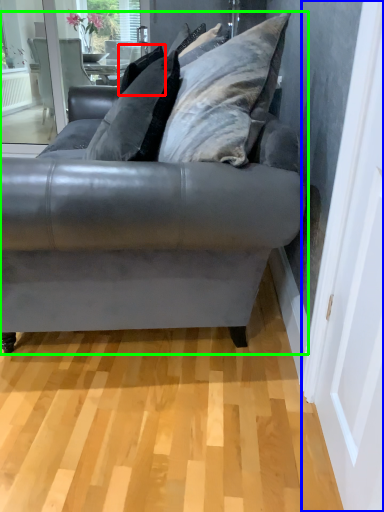
Question: Estimate the real-world distances between objects in this image. Which object is closer to pillow (highlighted by a red box), screen door (highlighted by a blue box) or studio couch (highlighted by a green box)?

Choices:
 (A) screen door
 (B) studio couch

Answer: (B)